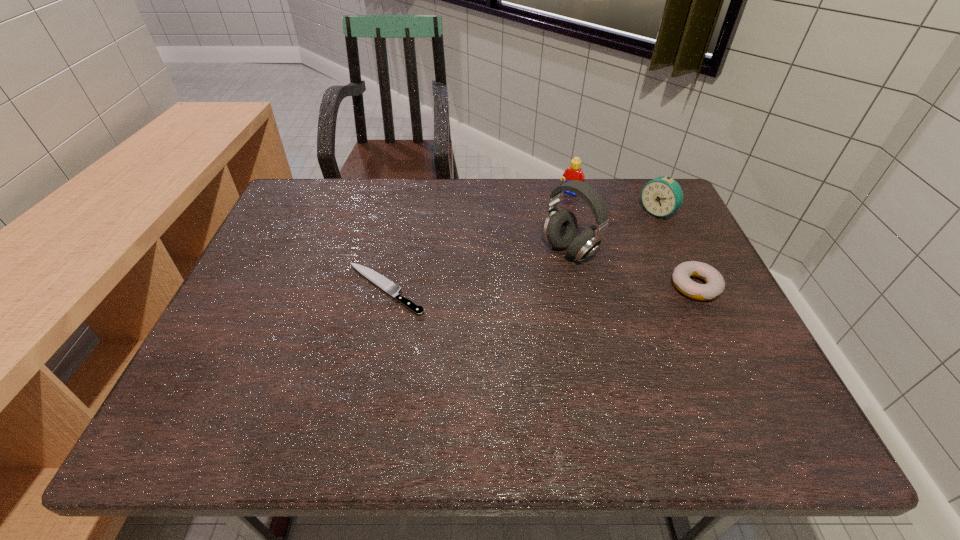
You are a GUI agent. You are given a task and a screenshot of the screen. Output one action in this format:
    pyautogui.click(x=<x>, y=<y>)
    Task: Click on the alarm clock that is at the right edge
    
    Given the screenshot: What is the action you would take?
    pyautogui.click(x=662, y=196)

You are a GUI agent. You are given a task and a screenshot of the screen. Output one action in this format:
    pyautogui.click(x=<x>, y=<y>)
    Task: Click on the object at the far right corner
    The image size is (960, 540).
    Given the screenshot: What is the action you would take?
    pyautogui.click(x=662, y=196)

Locate an element on the screen. The image size is (960, 540). vacant region at the far edge of the desktop is located at coordinates (424, 181).

Locate an element on the screen. vacant space at the near edge of the desktop is located at coordinates (356, 386).

Identify the location of vacant space at the right edge of the desktop. Image resolution: width=960 pixels, height=540 pixels. (683, 301).

In the image, there is a desktop. Where is `vacant space at the far right corner`? The width and height of the screenshot is (960, 540). vacant space at the far right corner is located at coordinates coord(625,191).

Where is `vacant space at the near right corner`? The height and width of the screenshot is (540, 960). vacant space at the near right corner is located at coordinates (748, 392).

Find the location of a particular element. free space between the leftmost object and the alarm clock is located at coordinates (520, 251).

At what (x,y) coordinates should I click in order to perform the action: click on vacant area between the alarm clock and the tallest object. Please return your answer as a coordinate pair (x, y). This screenshot has height=540, width=960. Looking at the image, I should click on 613,232.

Where is `free area in between the farthest object and the fourth nearest object`? This screenshot has width=960, height=540. free area in between the farthest object and the fourth nearest object is located at coordinates [613, 203].